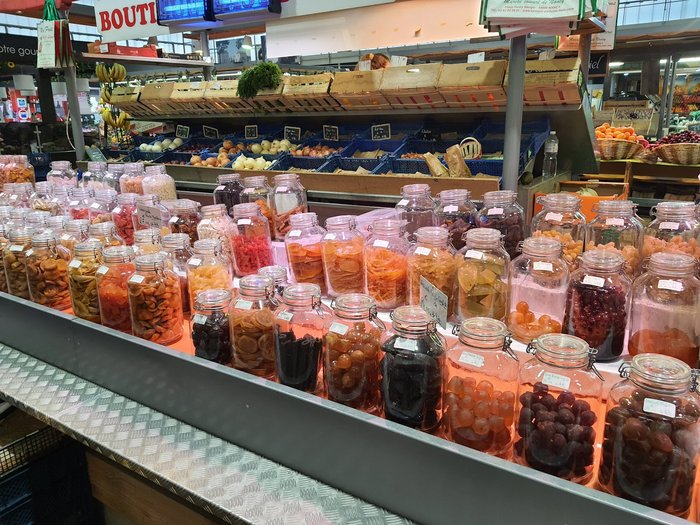
This screenshot has height=525, width=700. Find the location of `counter surface`. counter surface is located at coordinates (108, 413).